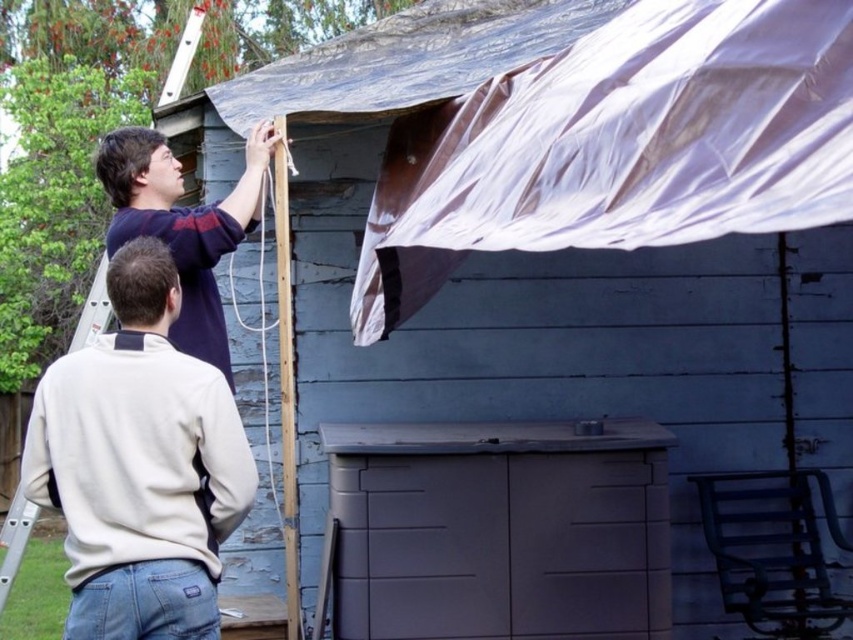
Consider the image. You are standing at the camera position and want to hand a tool to the person wearing the beige fleece sweatshirt at upper left. Can you reach them without moving from your current position?

The beige fleece sweatshirt at upper left is 3.19 meters away from the camera, so you cannot reach them without moving from your current position because the distance is too far.

You are a contractor assessing the scene. You notice two workers wearing beige fleece sweatshirt at upper left and matte blue shirt at upper left. Which worker is wearing a larger sized clothing item?

The beige fleece sweatshirt at upper left has a larger size compared to matte blue shirt at upper left, so the worker wearing the beige fleece sweatshirt at upper left is wearing the larger sized clothing item.